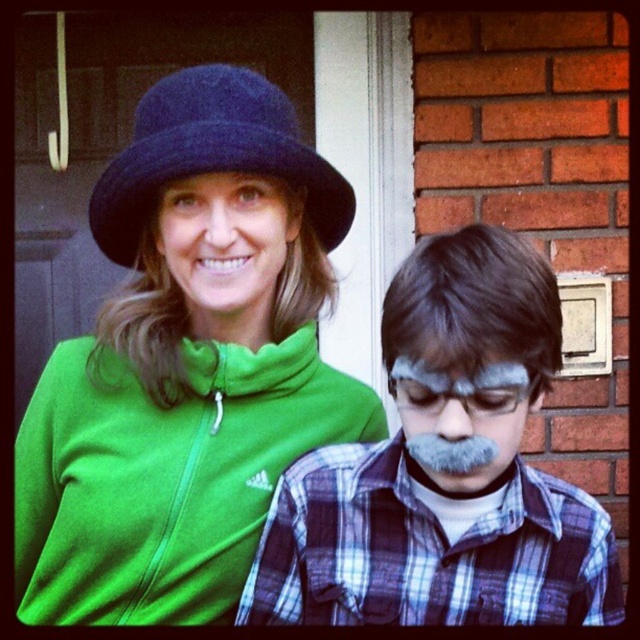
You are designing a costume for a play and need to ensure that the plaid fabric shirt at center and the dark blue felt hat at upper center fit together. Which item should you adjust in size to make them proportional?

The plaid fabric shirt at center is bigger than the dark blue felt hat at upper center. To make them proportional, you should reduce the size of the plaid fabric shirt at center or increase the size of the dark blue felt hat at upper center.

You are trying to decide which item to take with you for a quick walk. The matte green hoodie at upper left and the matte green hat at upper center are both available. Which one is bigger and more suitable for covering your upper body?

The matte green hoodie at upper left is larger in size than the matte green hat at upper center, so it is more suitable for covering your upper body.

You are designing a display for a clothing store and need to arrange the matte green hoodie at upper left and the dark blue felt hat at upper center on a mannequin. Which item should you place first if you want to ensure there is enough space for both?

You should place the matte green hoodie at upper left first because it is wider than the dark blue felt hat at upper center, ensuring there is enough space for both items on the mannequin.